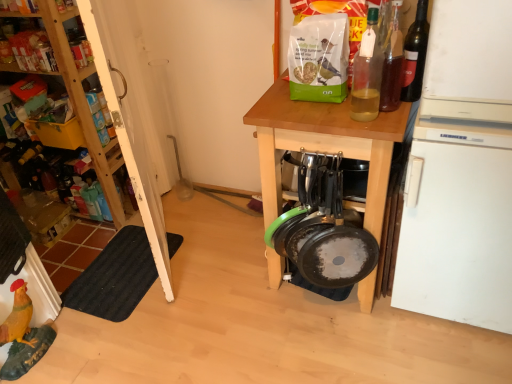
I want to click on vacant area that is in front of translucent glass bottle at upper right, which is the second bottle in left-to-right order, so click(x=386, y=124).